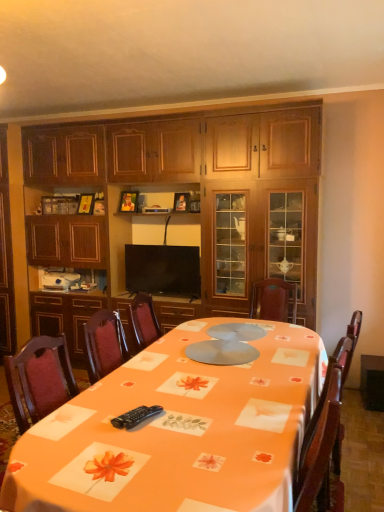
Question: From the image's perspective, relative to orange fabric table at center, is wooden cabinet at center above or below?

Choices:
 (A) above
 (B) below

Answer: (A)

Question: Would you say wooden cabinet at center is inside or outside orange fabric table at center?

Choices:
 (A) inside
 (B) outside

Answer: (B)

Question: Which is nearer to the black plastic remote control at lower center?

Choices:
 (A) flat screen tv at center
 (B) orange fabric table at center
 (C) wooden cabinet at center

Answer: (B)

Question: Which of these objects is positioned farthest from the black plastic remote control at lower center?

Choices:
 (A) orange fabric table at center
 (B) flat screen tv at center
 (C) wooden cabinet at center

Answer: (C)